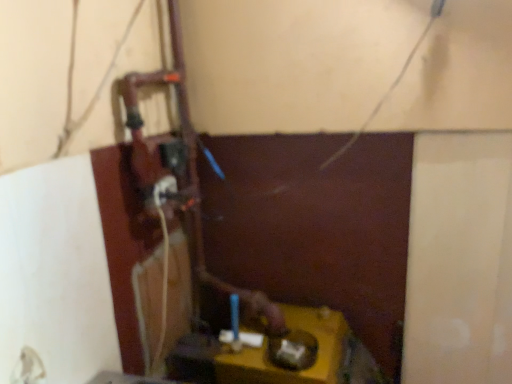
Where is `yellow matte table at lower center`? This screenshot has width=512, height=384. yellow matte table at lower center is located at coordinates (285, 369).

Image resolution: width=512 pixels, height=384 pixels. Describe the element at coordinates (285, 369) in the screenshot. I see `yellow matte table at lower center` at that location.

This screenshot has height=384, width=512. Describe the element at coordinates (164, 190) in the screenshot. I see `white plastic power plugs and sockets at center-left` at that location.

Where is `white plastic power plugs and sockets at center-left`? white plastic power plugs and sockets at center-left is located at coordinates (164, 190).

Identify the location of yellow matte table at lower center. (285, 369).

Which is more to the right, white plastic power plugs and sockets at center-left or yellow matte table at lower center?

From the viewer's perspective, yellow matte table at lower center appears more on the right side.

Which is behind, white plastic power plugs and sockets at center-left or yellow matte table at lower center?

white plastic power plugs and sockets at center-left.

Which is closer, (170,178) or (223,373)?

Point (170,178) is farther from the camera than point (223,373).

From the image's perspective, is white plastic power plugs and sockets at center-left positioned above or below yellow matte table at lower center?

From the image's perspective, white plastic power plugs and sockets at center-left appears above yellow matte table at lower center.

From a real-world perspective, is white plastic power plugs and sockets at center-left physically below yellow matte table at lower center?

No.

Between white plastic power plugs and sockets at center-left and yellow matte table at lower center, which one has larger width?

Wider between the two is yellow matte table at lower center.

Can you confirm if white plastic power plugs and sockets at center-left is shorter than yellow matte table at lower center?

Yes.

Considering the sizes of objects white plastic power plugs and sockets at center-left and yellow matte table at lower center in the image provided, who is smaller, white plastic power plugs and sockets at center-left or yellow matte table at lower center?

With smaller size is white plastic power plugs and sockets at center-left.

From the picture: Is yellow matte table at lower center located within white plastic power plugs and sockets at center-left?

No, yellow matte table at lower center is not surrounded by white plastic power plugs and sockets at center-left.

Consider the image. Is white plastic power plugs and sockets at center-left far away from yellow matte table at lower center?

No.

Is white plastic power plugs and sockets at center-left positioned with its back to yellow matte table at lower center?

white plastic power plugs and sockets at center-left is not turned away from yellow matte table at lower center.

How many degrees apart are the facing directions of white plastic power plugs and sockets at center-left and yellow matte table at lower center?

The angle between the facing direction of white plastic power plugs and sockets at center-left and the facing direction of yellow matte table at lower center is 4.21 degrees.

Could you measure the distance between white plastic power plugs and sockets at center-left and yellow matte table at lower center?

white plastic power plugs and sockets at center-left is 22.62 inches away from yellow matte table at lower center.

Find the location of a particular element. The image size is (512, 384). power plugs and sockets that appears above the yellow matte table at lower center (from the image's perspective) is located at coordinates (164, 190).

Is yellow matte table at lower center to the right of white plastic power plugs and sockets at center-left from the viewer's perspective?

Yes.

Between yellow matte table at lower center and white plastic power plugs and sockets at center-left, which one is positioned behind?

white plastic power plugs and sockets at center-left is behind.

Is point (340, 371) positioned in front of point (163, 183)?

Yes, point (340, 371) is closer to viewer.

From the image's perspective, is yellow matte table at lower center beneath white plastic power plugs and sockets at center-left?

Indeed, from the image's perspective, yellow matte table at lower center is shown beneath white plastic power plugs and sockets at center-left.

From a real-world perspective, which is physically below, yellow matte table at lower center or white plastic power plugs and sockets at center-left?

yellow matte table at lower center.

Is yellow matte table at lower center thinner than white plastic power plugs and sockets at center-left?

In fact, yellow matte table at lower center might be wider than white plastic power plugs and sockets at center-left.

Which of these two, yellow matte table at lower center or white plastic power plugs and sockets at center-left, stands shorter?

Standing shorter between the two is white plastic power plugs and sockets at center-left.

Which of these two, yellow matte table at lower center or white plastic power plugs and sockets at center-left, is smaller?

With smaller size is white plastic power plugs and sockets at center-left.

Is yellow matte table at lower center not within white plastic power plugs and sockets at center-left?

Yes, yellow matte table at lower center is outside of white plastic power plugs and sockets at center-left.

Is yellow matte table at lower center beside white plastic power plugs and sockets at center-left?

They are not placed beside each other.

Is yellow matte table at lower center facing away from white plastic power plugs and sockets at center-left?

yellow matte table at lower center is not turned away from white plastic power plugs and sockets at center-left.

What are the coordinates of `power plugs and sockets that appears above the yellow matte table at lower center (from a real-world perspective)` in the screenshot? It's located at (164, 190).

At what (x,y) coordinates should I click in order to perform the action: click on power plugs and sockets above the yellow matte table at lower center (from a real-world perspective). Please return your answer as a coordinate pair (x, y). Looking at the image, I should click on (164, 190).

At what (x,y) coordinates should I click in order to perform the action: click on power plugs and sockets behind the yellow matte table at lower center. Please return your answer as a coordinate pair (x, y). The height and width of the screenshot is (384, 512). Looking at the image, I should click on (164, 190).